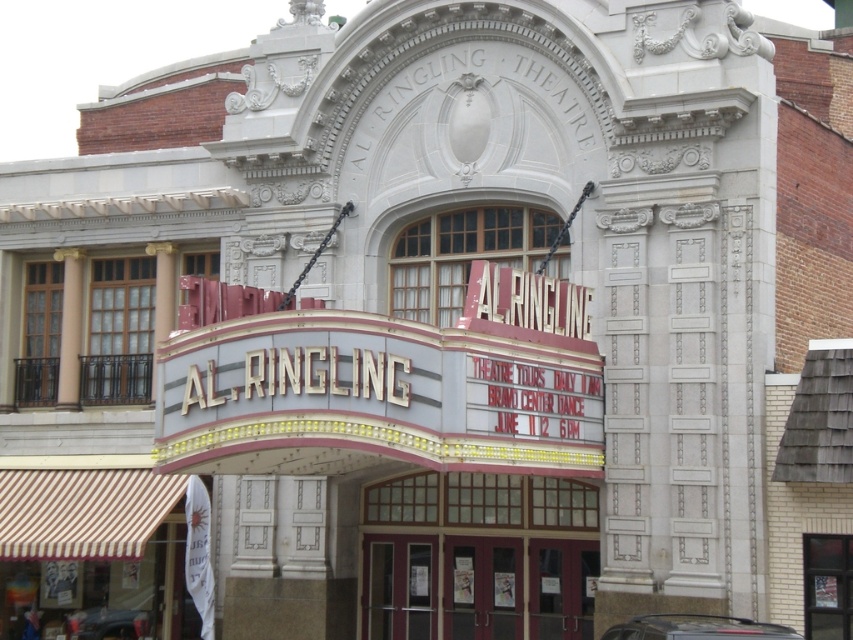
Question: Observing the image, what is the correct spatial positioning of glass door at center in reference to shiny black car at lower left?

Choices:
 (A) below
 (B) above

Answer: (B)

Question: Based on their relative distances, which object is farther from the glass door at center?

Choices:
 (A) shiny black car at lower center
 (B) shiny black car at lower left

Answer: (B)

Question: Is glass door at center wider than shiny black car at lower center?

Choices:
 (A) yes
 (B) no

Answer: (B)

Question: Does glass door at center appear over shiny black car at lower left?

Choices:
 (A) no
 (B) yes

Answer: (B)

Question: Which of the following is the farthest from the observer?

Choices:
 (A) shiny black car at lower center
 (B) glass door at center

Answer: (B)

Question: Which object is farther from the camera taking this photo?

Choices:
 (A) glass door at center
 (B) shiny black car at lower left

Answer: (B)